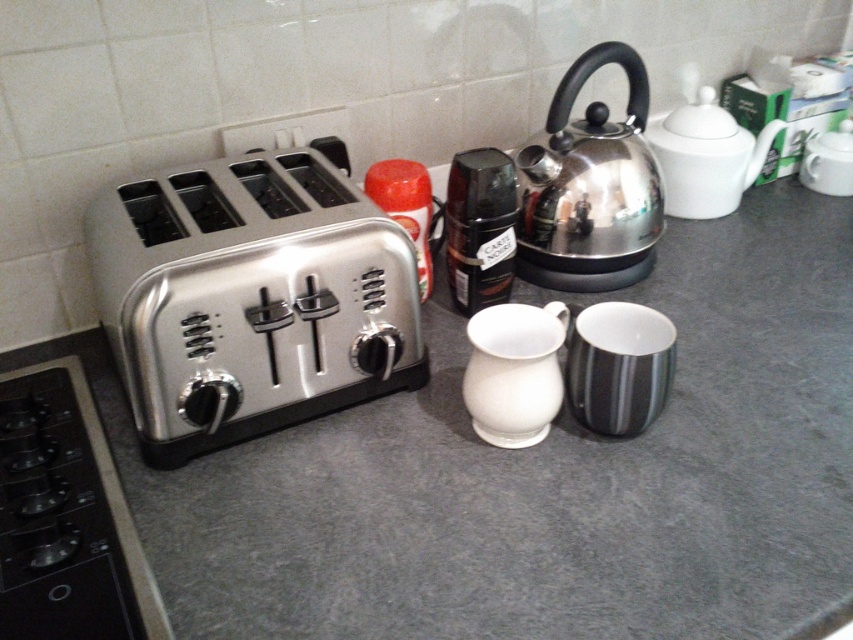
Consider the image. You are preparing to boil water for tea and see the shiny metallic kettle at upper right and the white glossy teapot at upper right. Which one has a greater height?

The shiny metallic kettle at upper right is much taller than the white glossy teapot at upper right, so the shiny metallic kettle at upper right has a greater height.